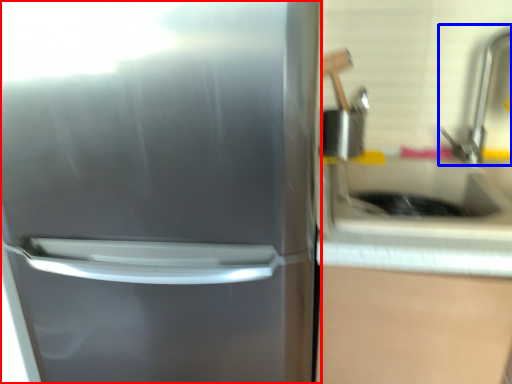
Question: Which object appears farthest to the camera in this image, refrigerator (highlighted by a red box) or faucet (highlighted by a blue box)?

Choices:
 (A) refrigerator
 (B) faucet

Answer: (B)